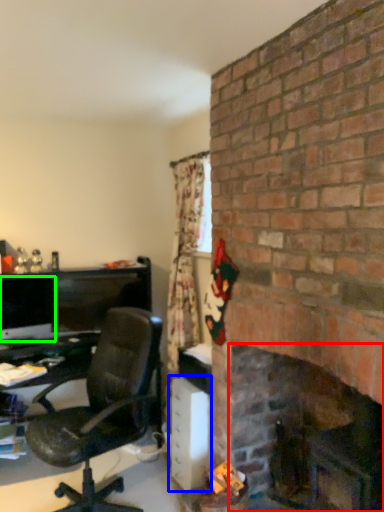
Question: Estimate the real-world distances between objects in this image. Which object is closer to fireplace (highlighted by a red box), file cabinet (highlighted by a blue box) or computer monitor (highlighted by a green box)?

Choices:
 (A) file cabinet
 (B) computer monitor

Answer: (A)